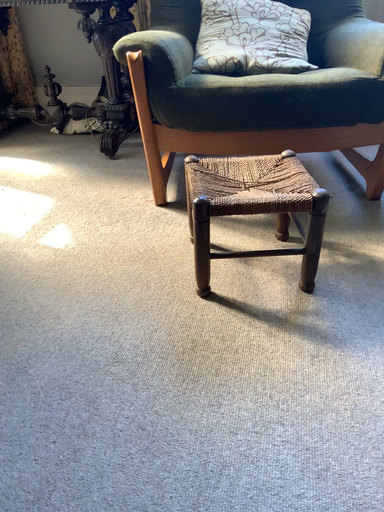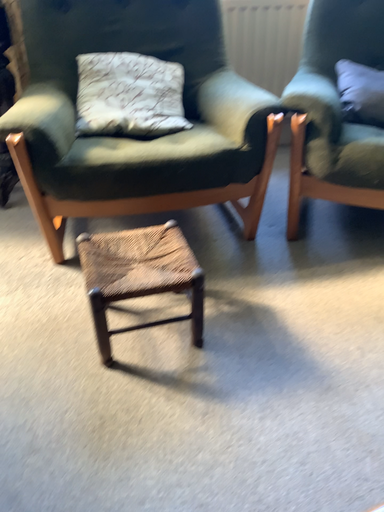
Question: Which way did the camera rotate in the video?

Choices:
 (A) rotated left
 (B) rotated right

Answer: (B)